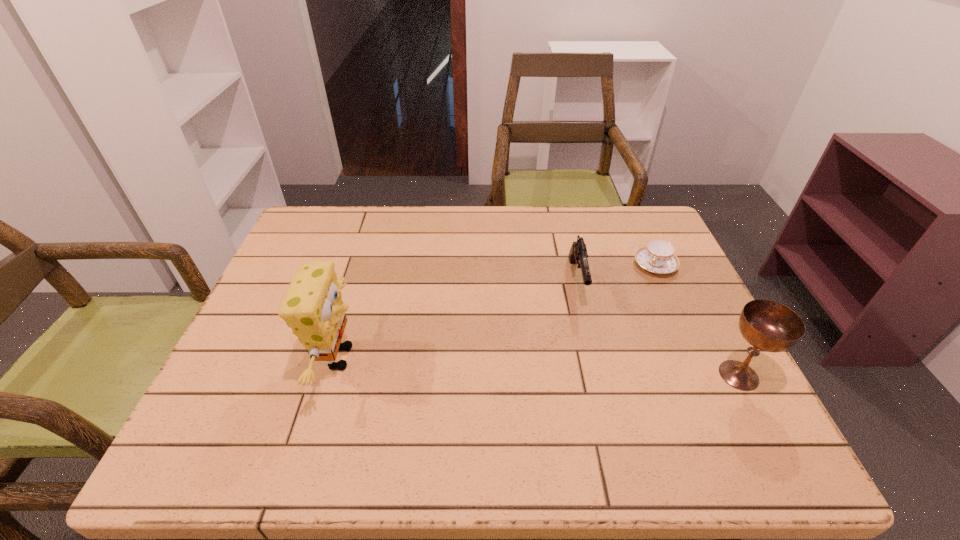
At what (x,y) coordinates should I click in order to perform the action: click on object situated at the near right corner. Please return your answer as a coordinate pair (x, y). This screenshot has width=960, height=540. Looking at the image, I should click on (767, 325).

At what (x,y) coordinates should I click in order to perform the action: click on blank area at the far edge. Please return your answer as a coordinate pair (x, y). This screenshot has height=540, width=960. Looking at the image, I should click on (614, 244).

At what (x,y) coordinates should I click in order to perform the action: click on free region at the left edge of the desktop. Please return your answer as a coordinate pair (x, y). Looking at the image, I should click on (282, 361).

At what (x,y) coordinates should I click in order to perform the action: click on vacant space at the right edge. Please return your answer as a coordinate pair (x, y). Looking at the image, I should click on (639, 302).

The height and width of the screenshot is (540, 960). I want to click on vacant space at the far left corner, so click(x=295, y=240).

This screenshot has width=960, height=540. Identify the location of vacant space at the far right corner of the desktop. (653, 226).

Locate an element on the screen. Image resolution: width=960 pixels, height=540 pixels. free space at the near right corner is located at coordinates (688, 419).

Locate an element on the screen. This screenshot has height=540, width=960. free space between the third shortest object and the shortest object is located at coordinates (697, 320).

Identify the location of free space between the sponge and the shortest object. This screenshot has height=540, width=960. (497, 312).

The image size is (960, 540). I want to click on empty location between the leftmost object and the third shortest object, so click(x=539, y=366).